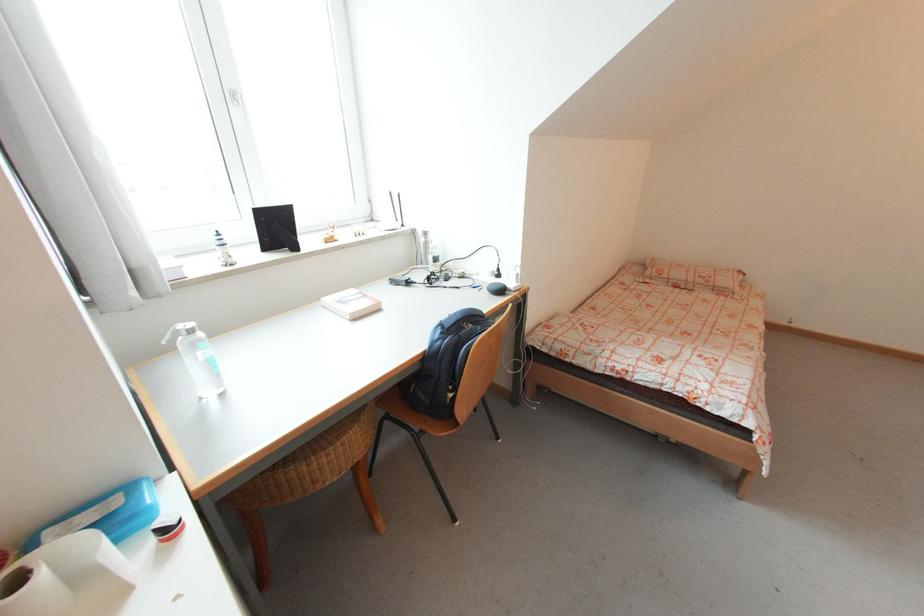
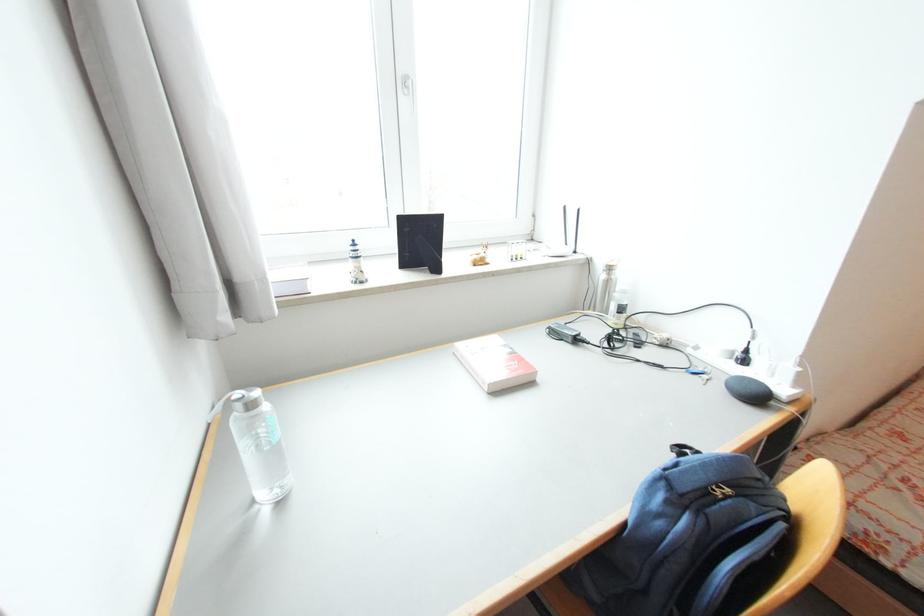
Where in the second image is the point corresponding to (492,291) from the first image?

(734, 387)